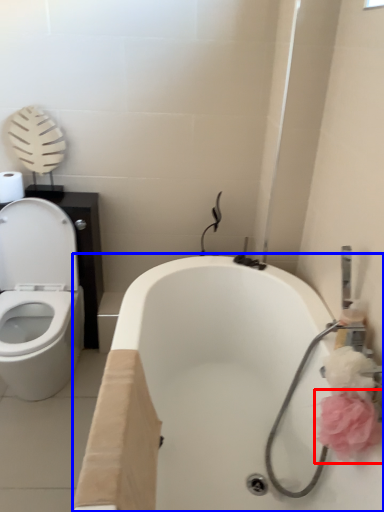
Question: Which object appears closest to the camera in this image, flower (highlighted by a red box) or bath (highlighted by a blue box)?

Choices:
 (A) flower
 (B) bath

Answer: (B)